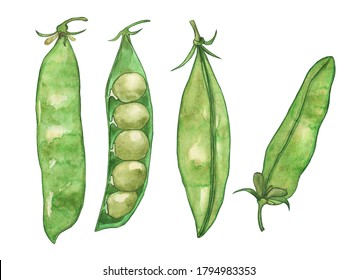
Find the location of a particular element. The width and height of the screenshot is (358, 280). painting is located at coordinates (129, 140).